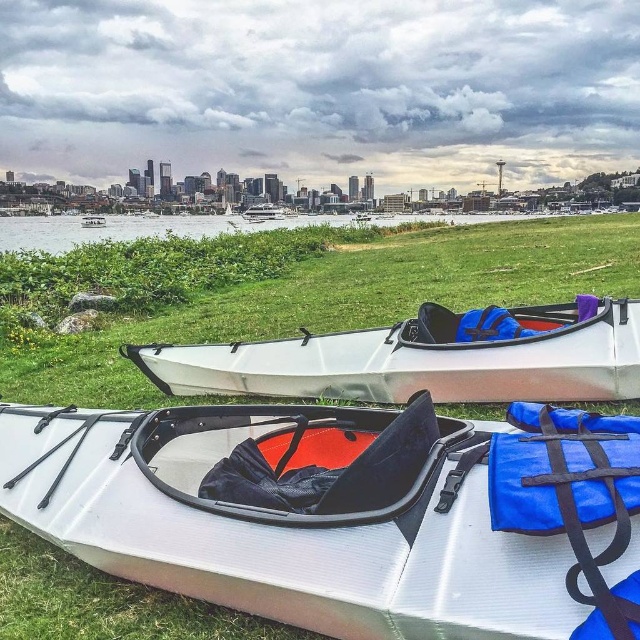
You are standing at the origin point of the image coordinate system. Which direction should you move to reach the white glossy kayak at center?

You should move towards the coordinates point (419, 360) to reach the white glossy kayak at center.

You are standing at the lakeside and want to know which of the two points, point (241,364) or point (244,211), is closer to you. Can you determine this based on the scene?

Point (241,364) is closer to the viewer than point (244,211).

You are planning to store both the white glossy kayak at center and the white glossy boat at center in a storage unit. Based on their heights, which one can be placed vertically without exceeding the storage unit height limit?

The white glossy kayak at center can be placed vertically without exceeding the storage unit height limit because it is shorter than the white glossy boat at center.